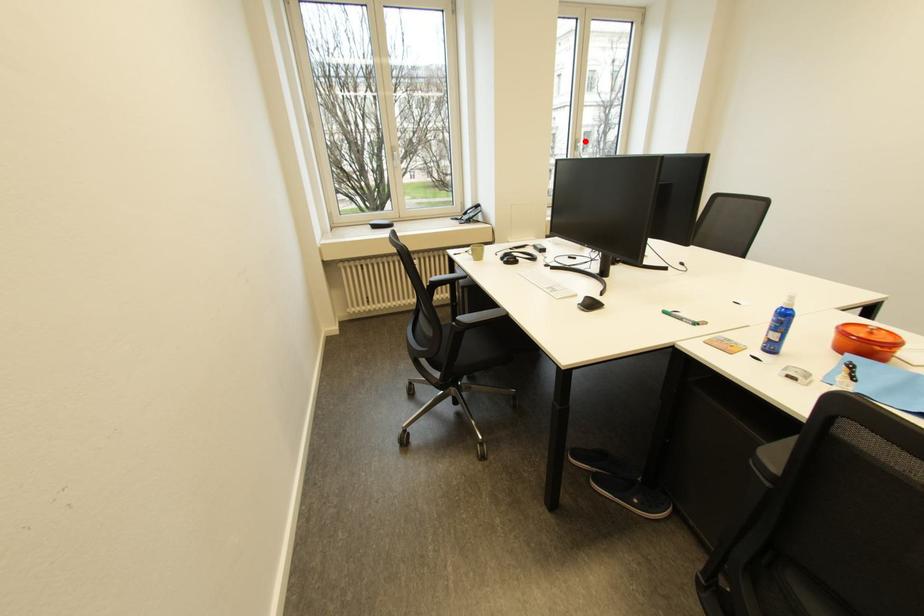
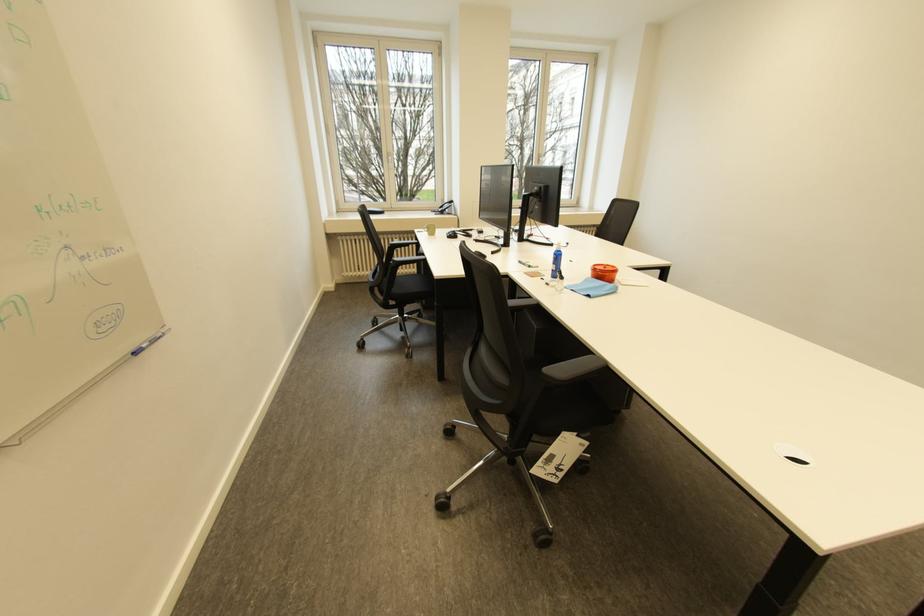
Question: I am providing you with two images of the same scene from different viewpoints. Image1 has a red point marked. In image2, the corresponding 3D location appears at what relative position? Reply with the corresponding letter.

Choices:
 (A) Closer
 (B) Farther

Answer: (A)